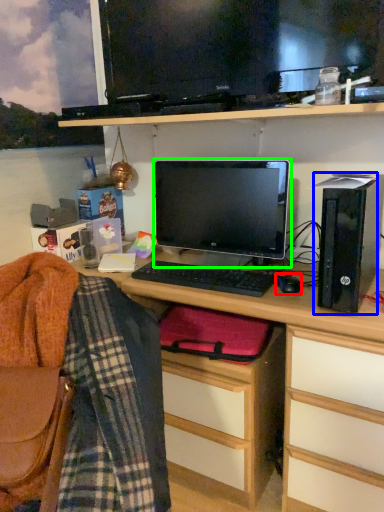
Question: Based on their relative distances, which object is farther from mouse (highlighted by a red box)? Choose from computer tower (highlighted by a blue box) and computer monitor (highlighted by a green box).

Choices:
 (A) computer tower
 (B) computer monitor

Answer: (B)